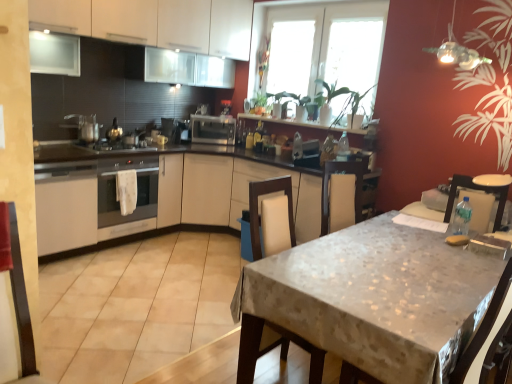
Find the location of a particular element. free space above transparent glass window at upper center, the second window viewed from the right (from a real-world perspective) is located at coordinates (292, 24).